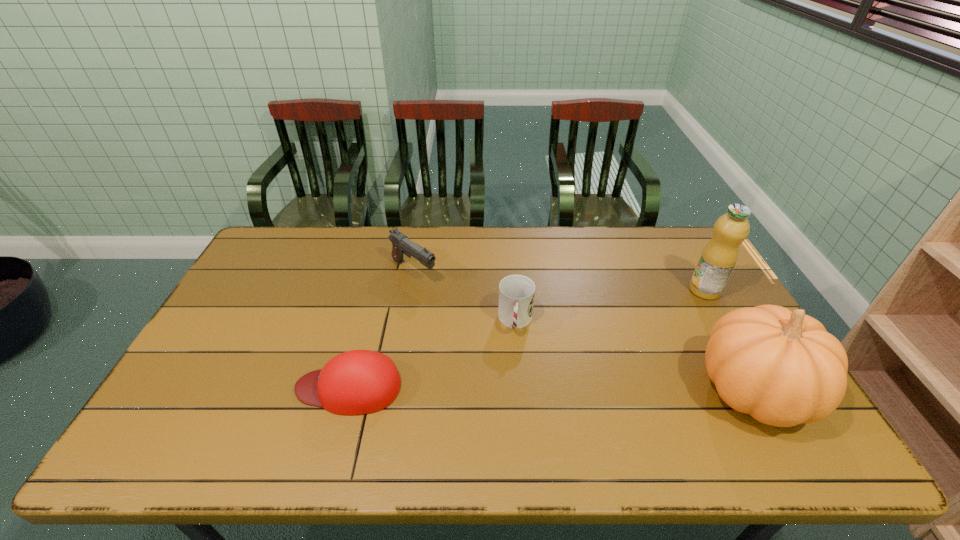
At what (x,y) coordinates should I click in order to perform the action: click on free space on the desktop that is between the baseball cap and the pumpkin and is positioned on the side of the third object from left to right where the handle is located. Please return your answer as a coordinate pair (x, y). This screenshot has width=960, height=540. Looking at the image, I should click on (512, 388).

The image size is (960, 540). In order to click on vacant space on the desktop that is between the baseball cap and the pumpkin and is positioned on the front label of the fruit juice in this screenshot , I will do `click(543, 388)`.

Where is `vacant space on the desktop that is between the baseball cap and the pumpkin and is positioned in the direction the gun is aimed`? The width and height of the screenshot is (960, 540). vacant space on the desktop that is between the baseball cap and the pumpkin and is positioned in the direction the gun is aimed is located at coordinates (579, 388).